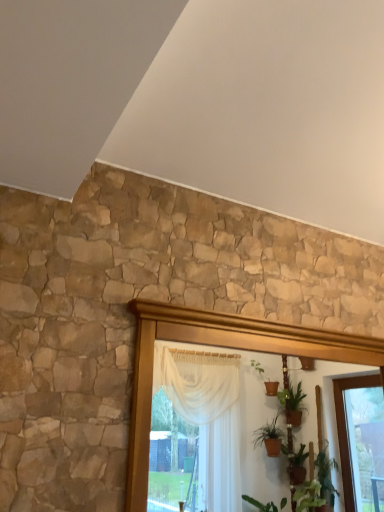
In the scene shown: Measure the distance between wooden frame at center and camera.

wooden frame at center is 3.93 feet from camera.

This screenshot has height=512, width=384. Find the location of `wooden frame at center`. wooden frame at center is located at coordinates (218, 346).

What do you see at coordinates (218, 346) in the screenshot? The height and width of the screenshot is (512, 384). I see `wooden frame at center` at bounding box center [218, 346].

This screenshot has height=512, width=384. Identify the location of wooden frame at center. (218, 346).